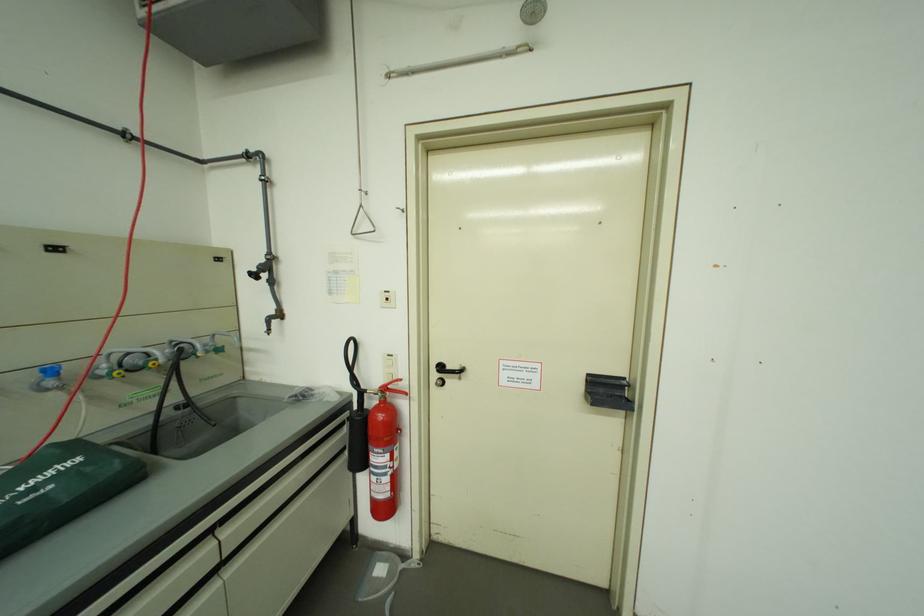
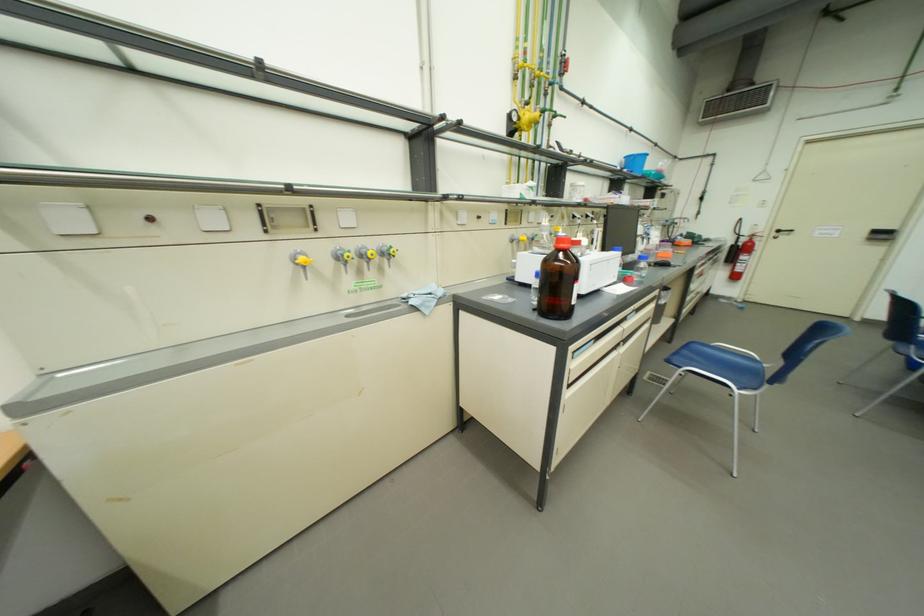
Where in the second image is the point corresponding to the point at 451,369 from the first image?

(787, 233)